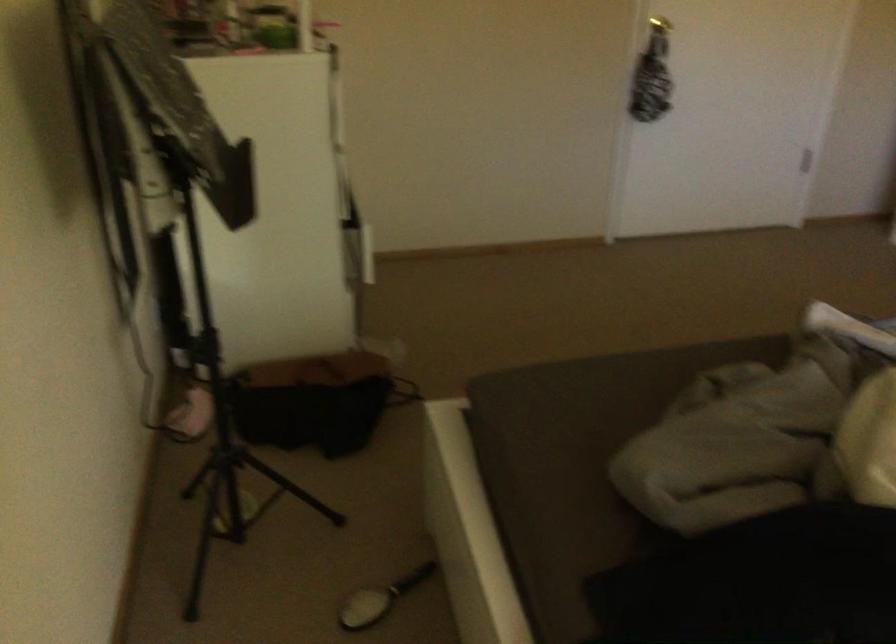
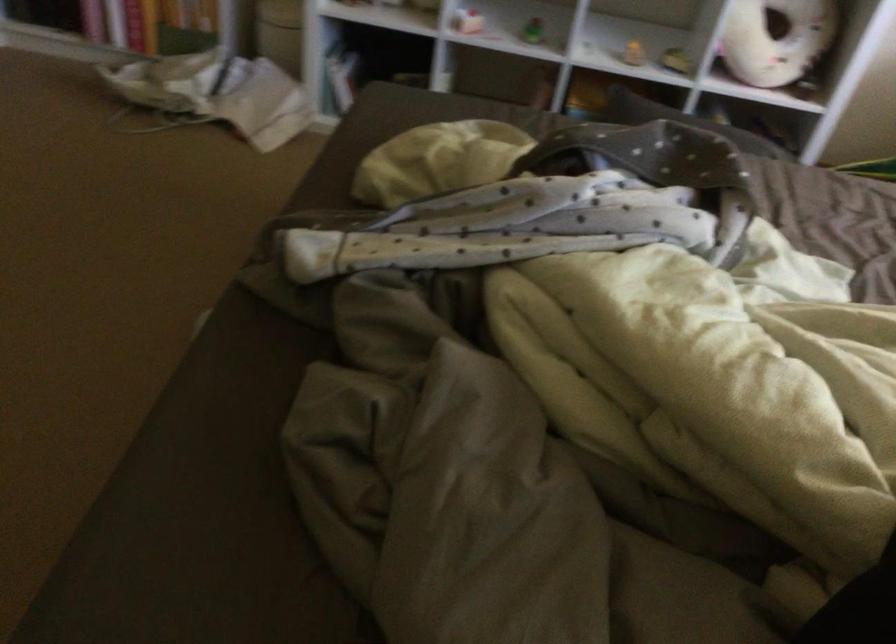
First-person continuous shooting, in which direction is the camera rotating?

The camera's rotation is toward right-down.